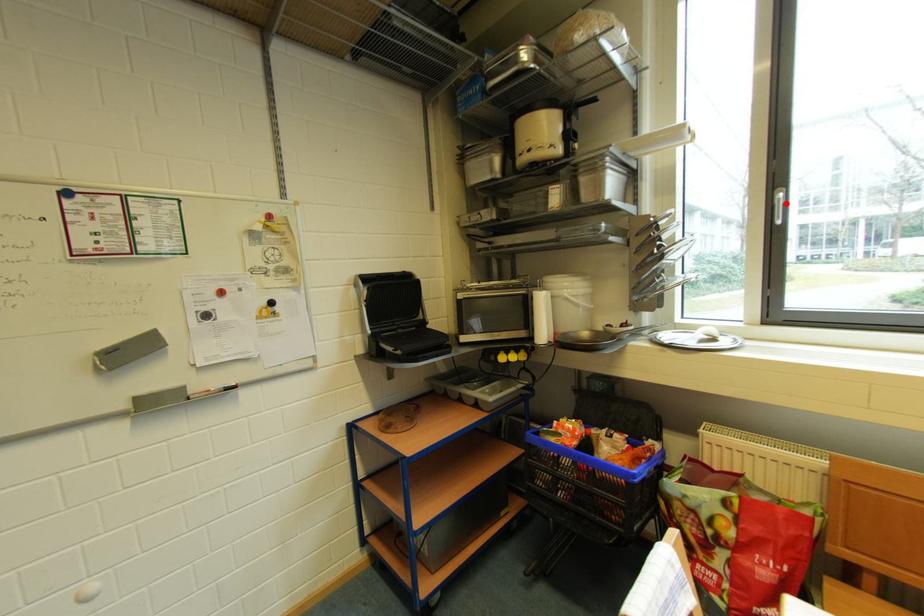
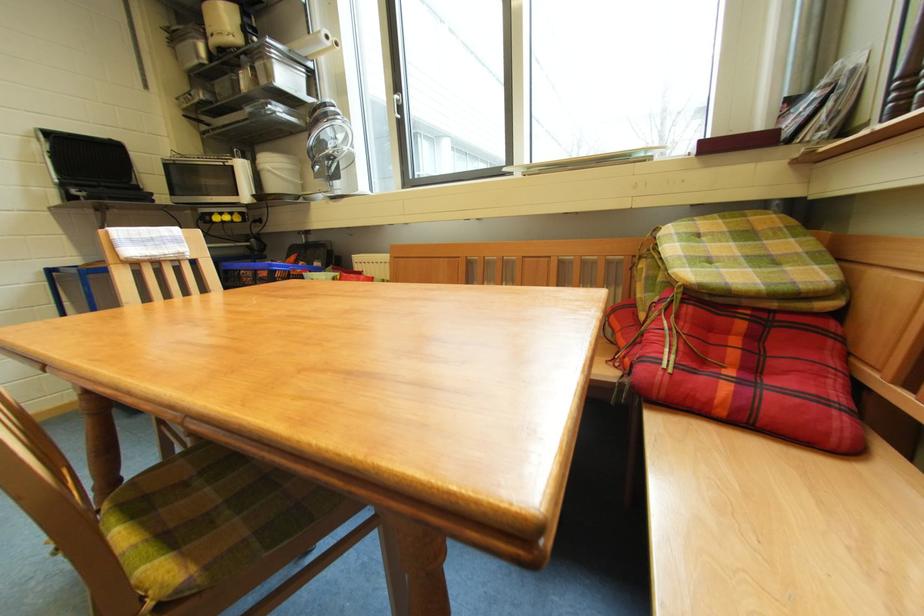
The point at the highlighted location is marked in the first image. Where is the corresponding point in the second image?

(402, 102)